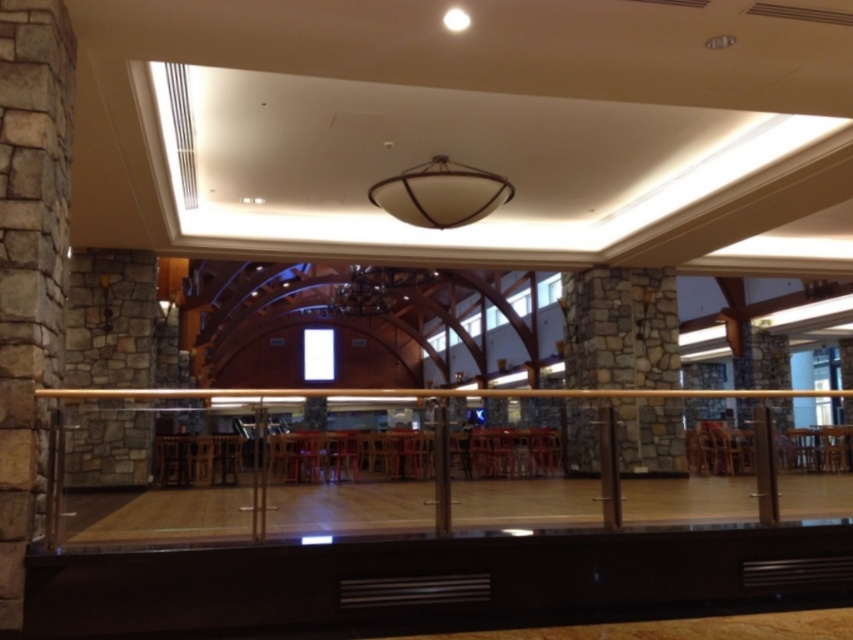
You are a delivery person carrying a package that is 2 meters long. You need to navigate through the space between the satin gold railing at center and the stone textured pillar at left. Can you pass through this area without tilting the package?

The distance between the satin gold railing at center and the stone textured pillar at left is 1.96 meters. Since the package is 2 meters long, it is slightly too long to fit through the space without tilting or adjusting the package.

You are standing at the satin gold railing at center and want to move to the stone textured pillar at left. Can you walk directly to it without going around?

The stone textured pillar at left is behind the satin gold railing at center, so you can walk directly to it since it is in the same area behind the railing.

You are standing in the center of the room and want to move towards the satin gold railing at center. In which direction should you walk?

The satin gold railing at center is located at point (402, 484) in 2D coordinates, so you should walk towards the center of the room to reach it.